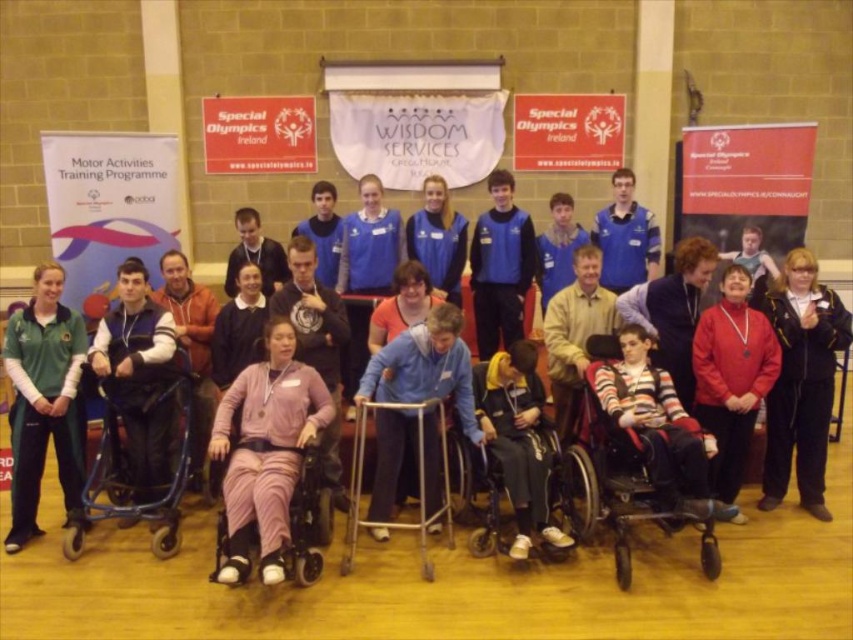
Which is more to the left, black leather jacket at lower right or light pink fabric wheelchair at center?

Positioned to the left is light pink fabric wheelchair at center.

Is point (825, 296) positioned in front of point (235, 563)?

No, (825, 296) is behind (235, 563).

The width and height of the screenshot is (853, 640). Identify the location of black leather jacket at lower right. (801, 381).

Between green fleece jacket at left and black plastic wheelchair at center, which one has less height?

With less height is black plastic wheelchair at center.

Who is positioned more to the left, green fleece jacket at left or black plastic wheelchair at center?

green fleece jacket at left

Find the location of a particular element. This screenshot has width=853, height=640. green fleece jacket at left is located at coordinates pyautogui.click(x=44, y=401).

Does blue fabric jacket at center have a greater width compared to blue fleece jacket at center?

Yes.

Is point (515, 312) closer to viewer compared to point (436, 186)?

That is False.

Who is more forward, (521,323) or (433,268)?

Point (433,268) is more forward.

Image resolution: width=853 pixels, height=640 pixels. I want to click on blue fabric jacket at center, so click(x=500, y=266).